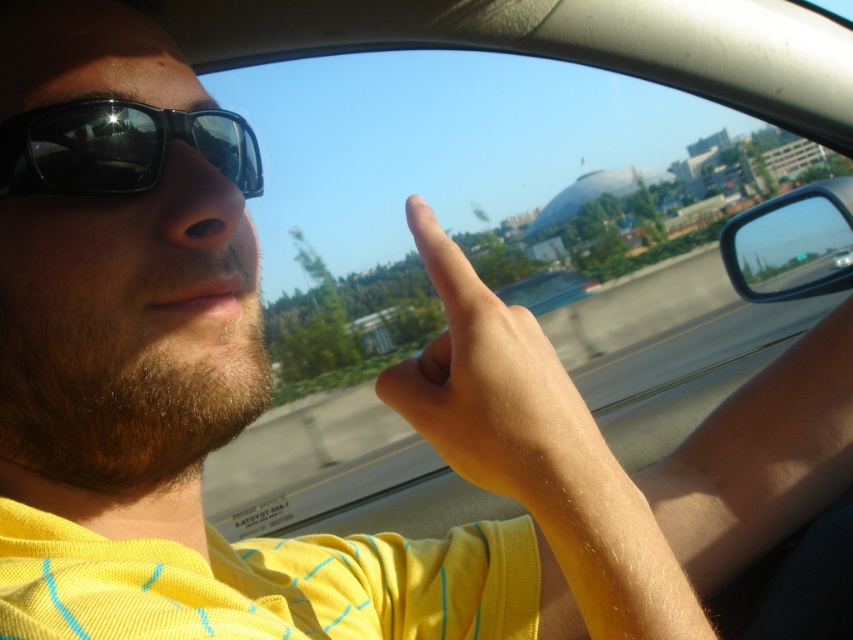
Looking at this image, you are sitting in the passenger seat of the car and notice two points marked in the image. The first point is at coordinates point (415, 168) and the second is at point (62, 145). Which of these points is closer to you?

Point (62, 145) is closer to you because it is nearer to the camera than point (415, 168), which is further away.

From the picture: You are a passenger in the car and want to know if you can see the buildings in the distance through the transparent glass window at center without the skinny yellow finger at upper center blocking your view. Can you see them?

The transparent glass window at center is wider than the skinny yellow finger at upper center, so yes, you can see the buildings in the distance through the transparent glass window at center without the skinny yellow finger at upper center blocking your view.

You are a passenger in the car and want to see the dome building outside. You notice the transparent glass window at center and the matte black sunglasses at upper left. Which object allows you to see the dome building more clearly?

The transparent glass window at center allows you to see the dome building more clearly because it is larger than the matte black sunglasses at upper left.